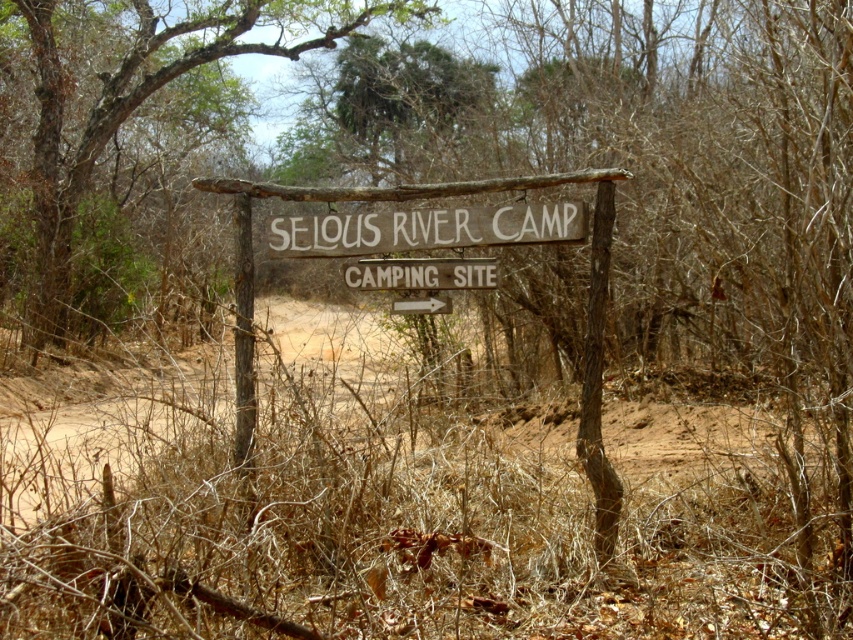
Question: Can you confirm if brown wood sign at center is smaller than wooden signboard at center?

Choices:
 (A) no
 (B) yes

Answer: (B)

Question: Which of these objects is positioned closest to the wooden signboard at center?

Choices:
 (A) brown wood sign at center
 (B) brown sandy dirt at center
 (C) brown wooden sign at center

Answer: (C)

Question: Is brown sandy dirt at center to the right of brown wood sign at center from the viewer's perspective?

Choices:
 (A) yes
 (B) no

Answer: (A)

Question: Which of the following is the closest to the observer?

Choices:
 (A) pyautogui.click(x=47, y=314)
 (B) pyautogui.click(x=459, y=284)
 (C) pyautogui.click(x=589, y=177)
 (D) pyautogui.click(x=212, y=420)

Answer: (C)

Question: Can you confirm if wooden signboard at center is positioned to the right of brown wooden sign at center?

Choices:
 (A) yes
 (B) no

Answer: (B)

Question: Which point appears closest to the camera in this image?

Choices:
 (A) (479, 273)
 (B) (601, 220)

Answer: (B)